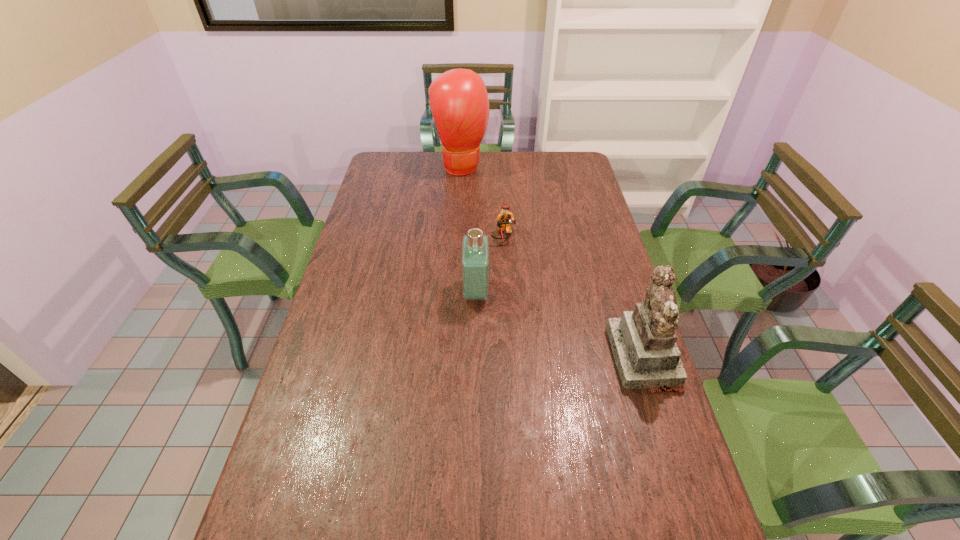
This screenshot has height=540, width=960. I want to click on vacant space at the far edge, so click(x=435, y=171).

The image size is (960, 540). In the image, there is a desktop. Find the location of `free region at the near edge`. free region at the near edge is located at coordinates (485, 522).

In the image, there is a desktop. Where is `free space at the left edge`? The width and height of the screenshot is (960, 540). free space at the left edge is located at coordinates (377, 305).

What are the coordinates of `free region at the right edge of the desktop` in the screenshot? It's located at (577, 181).

You are a GUI agent. You are given a task and a screenshot of the screen. Output one action in this format:
    pyautogui.click(x=<x>, y=<y>)
    Task: Click on the vacant space at the far left corner
    This screenshot has height=540, width=960.
    Given the screenshot: What is the action you would take?
    pyautogui.click(x=410, y=152)

The height and width of the screenshot is (540, 960). I want to click on free space that is in between the third nearest object and the farthest object, so click(x=482, y=201).

Locate an element on the screen. free spot between the third farthest object and the nearest object is located at coordinates (560, 325).

Locate an element on the screen. vacant space in between the shortest object and the nearest object is located at coordinates (573, 297).

Where is `free space that is in between the figurine and the tallest object`? free space that is in between the figurine and the tallest object is located at coordinates (552, 262).

I want to click on free space between the rightmost object and the shortest object, so click(573, 297).